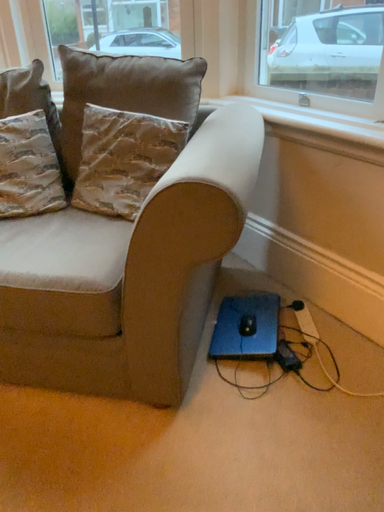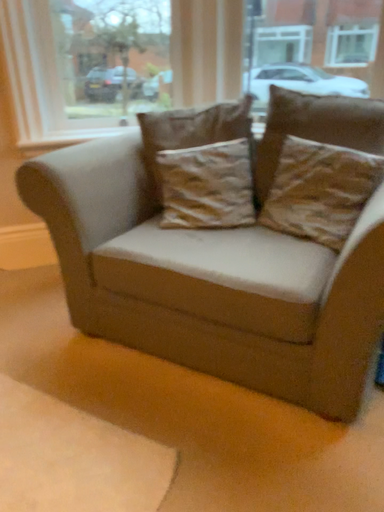
Question: Which way did the camera rotate in the video?

Choices:
 (A) rotated left
 (B) rotated right

Answer: (A)